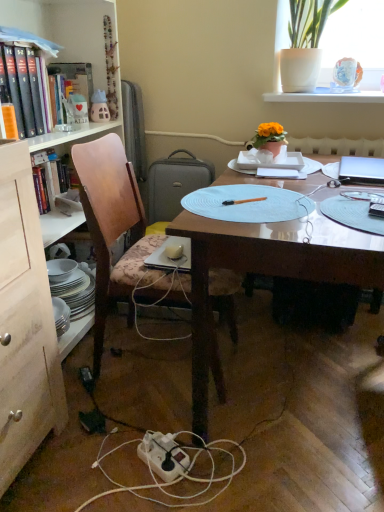
This screenshot has height=512, width=384. In order to click on free space behind black plastic power plugs and sockets at lower left, which is counted as the 2th power plugs and sockets, starting from the bottom in this screenshot , I will do `click(105, 359)`.